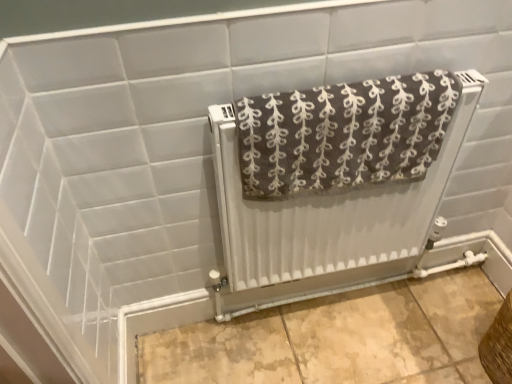
Question: Is brown textured towel at center shorter than white textured radiator at center?

Choices:
 (A) yes
 (B) no

Answer: (A)

Question: Is brown textured towel at center bigger than white textured radiator at center?

Choices:
 (A) no
 (B) yes

Answer: (A)

Question: Can you confirm if brown textured towel at center is thinner than white textured radiator at center?

Choices:
 (A) yes
 (B) no

Answer: (B)

Question: From a real-world perspective, is brown textured towel at center on top of white textured radiator at center?

Choices:
 (A) yes
 (B) no

Answer: (A)

Question: From the image's perspective, would you say brown textured towel at center is shown under white textured radiator at center?

Choices:
 (A) no
 (B) yes

Answer: (A)

Question: Based on their positions, is brown textured towel at center located to the left or right of brown woven basket at lower right?

Choices:
 (A) left
 (B) right

Answer: (A)

Question: From a real-world perspective, is brown textured towel at center physically located above or below brown woven basket at lower right?

Choices:
 (A) above
 (B) below

Answer: (A)

Question: Looking at the image, does brown textured towel at center seem bigger or smaller compared to brown woven basket at lower right?

Choices:
 (A) big
 (B) small

Answer: (A)

Question: Considering the positions of point (430, 89) and point (489, 365), is point (430, 89) closer or farther from the camera than point (489, 365)?

Choices:
 (A) closer
 (B) farther

Answer: (A)

Question: Considering the positions of white textured radiator at center and brown woven basket at lower right in the image, is white textured radiator at center wider or thinner than brown woven basket at lower right?

Choices:
 (A) wide
 (B) thin

Answer: (B)

Question: Relative to brown woven basket at lower right, is white textured radiator at center in front or behind?

Choices:
 (A) behind
 (B) front

Answer: (B)

Question: Based on their positions, is white textured radiator at center located to the left or right of brown woven basket at lower right?

Choices:
 (A) right
 (B) left

Answer: (B)

Question: Is point coord(284,297) positioned closer to the camera than point coord(504,321)?

Choices:
 (A) closer
 (B) farther

Answer: (B)

Question: Is point tap(249, 145) closer or farther from the camera than point tap(279, 251)?

Choices:
 (A) farther
 (B) closer

Answer: (B)

Question: Visually, is brown textured towel at center positioned to the left or to the right of white textured radiator at center?

Choices:
 (A) right
 (B) left

Answer: (B)